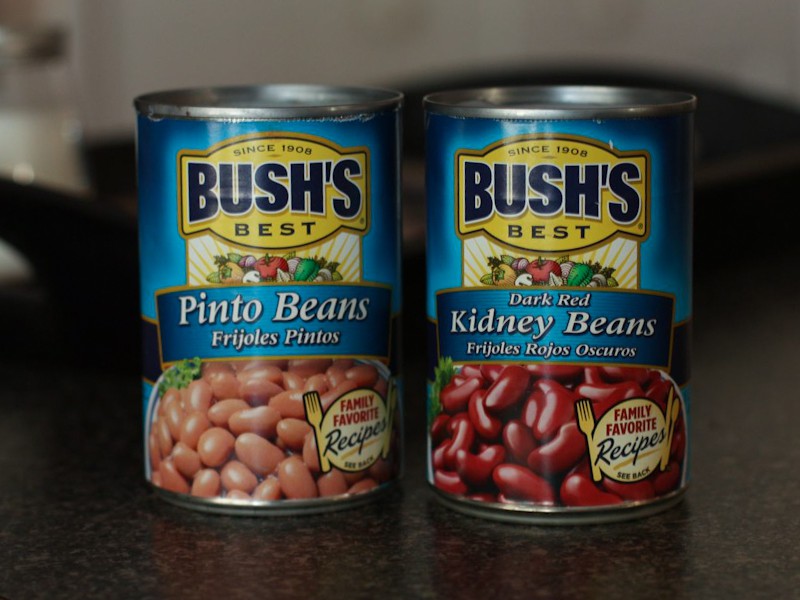
Where is `2 forks`? 2 forks is located at coordinates (582, 423), (320, 408).